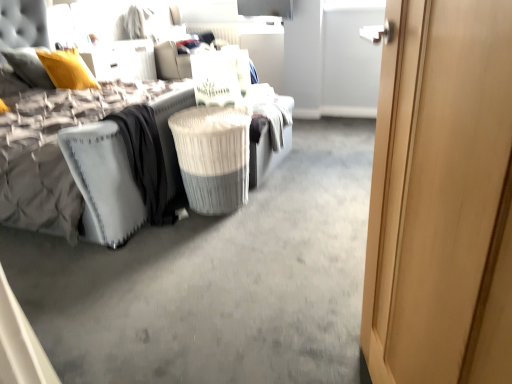
Question: Considering the relative sizes of white textured mattress at left and velvet grey bed at center in the image provided, is white textured mattress at left bigger than velvet grey bed at center?

Choices:
 (A) no
 (B) yes

Answer: (A)

Question: Considering the relative positions of white textured mattress at left and velvet grey bed at center in the image provided, is white textured mattress at left to the left of velvet grey bed at center from the viewer's perspective?

Choices:
 (A) yes
 (B) no

Answer: (B)

Question: From the image's perspective, would you say white textured mattress at left is positioned over velvet grey bed at center?

Choices:
 (A) no
 (B) yes

Answer: (A)

Question: Is white textured mattress at left not close to velvet grey bed at center?

Choices:
 (A) yes
 (B) no

Answer: (B)

Question: Is white textured mattress at left facing towards velvet grey bed at center?

Choices:
 (A) yes
 (B) no

Answer: (A)

Question: Considering their positions, is velvet grey bed at center located in front of or behind white textured mattress at left?

Choices:
 (A) behind
 (B) front

Answer: (B)

Question: From the image's perspective, relative to white textured mattress at left, is velvet grey bed at center above or below?

Choices:
 (A) below
 (B) above

Answer: (B)

Question: Considering the positions of velvet grey bed at center and white textured mattress at left in the image, is velvet grey bed at center bigger or smaller than white textured mattress at left?

Choices:
 (A) big
 (B) small

Answer: (A)

Question: In the image, is velvet grey bed at center on the left side or the right side of white textured mattress at left?

Choices:
 (A) left
 (B) right

Answer: (A)

Question: From a real-world perspective, is white textured mattress at left physically located above or below light wood door at right?

Choices:
 (A) above
 (B) below

Answer: (B)

Question: In terms of width, does white textured mattress at left look wider or thinner when compared to light wood door at right?

Choices:
 (A) thin
 (B) wide

Answer: (B)

Question: Looking at the image, does white textured mattress at left seem bigger or smaller compared to light wood door at right?

Choices:
 (A) small
 (B) big

Answer: (B)

Question: In terms of height, does white textured mattress at left look taller or shorter compared to light wood door at right?

Choices:
 (A) tall
 (B) short

Answer: (B)

Question: From a real-world perspective, is white wicker laundry basket at center positioned above or below white textured mattress at left?

Choices:
 (A) below
 (B) above

Answer: (A)

Question: Considering the positions of white wicker laundry basket at center and white textured mattress at left in the image, is white wicker laundry basket at center wider or thinner than white textured mattress at left?

Choices:
 (A) wide
 (B) thin

Answer: (B)